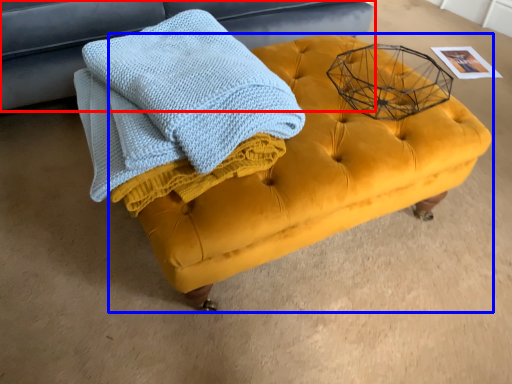
Question: Which of the following is the closest to the observer, furniture (highlighted by a red box) or table (highlighted by a blue box)?

Choices:
 (A) furniture
 (B) table

Answer: (B)